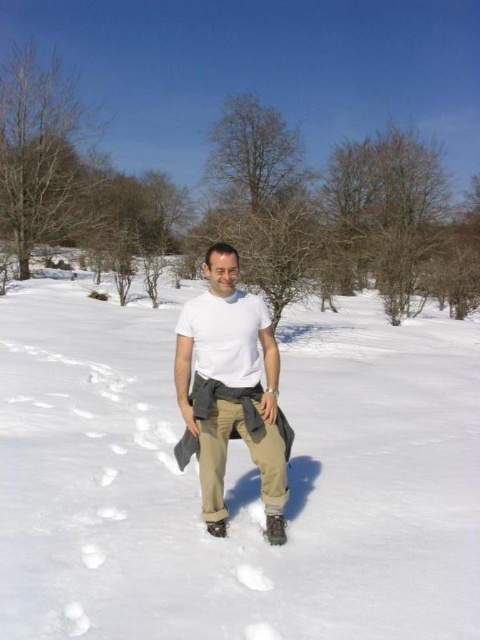
Looking at this image, is white fluffy snow at center bigger than white matte t-shirt at center?

Yes.

Where is `white fluffy snow at center`? The width and height of the screenshot is (480, 640). white fluffy snow at center is located at coordinates coord(236,480).

Locate an element on the screen. white fluffy snow at center is located at coordinates (236, 480).

Does white fluffy snow at center have a greater width compared to white matte shirt at center?

Yes.

Does white fluffy snow at center have a larger size compared to white matte shirt at center?

Indeed, white fluffy snow at center has a larger size compared to white matte shirt at center.

At what (x,y) coordinates should I click in order to perform the action: click on white fluffy snow at center. Please return your answer as a coordinate pair (x, y). This screenshot has height=640, width=480. Looking at the image, I should click on (236, 480).

Is white matte t-shirt at center shorter than white matte shirt at center?

No, white matte t-shirt at center is not shorter than white matte shirt at center.

Does white matte t-shirt at center appear on the right side of white matte shirt at center?

Correct, you'll find white matte t-shirt at center to the right of white matte shirt at center.

At what (x,y) coordinates should I click in order to perform the action: click on white matte t-shirt at center. Please return your answer as a coordinate pair (x, y). The image size is (480, 640). Looking at the image, I should click on (230, 392).